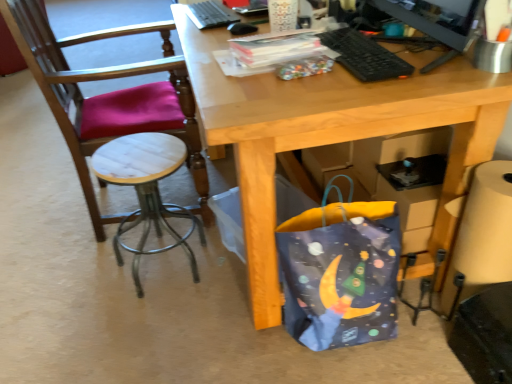
Find the location of a particular element. This screenshot has width=512, height=384. free space underneath black plastic keyboard at upper center, which is counted as the first laptop keyboard, starting from the left (from a real-world perspective) is located at coordinates (226, 175).